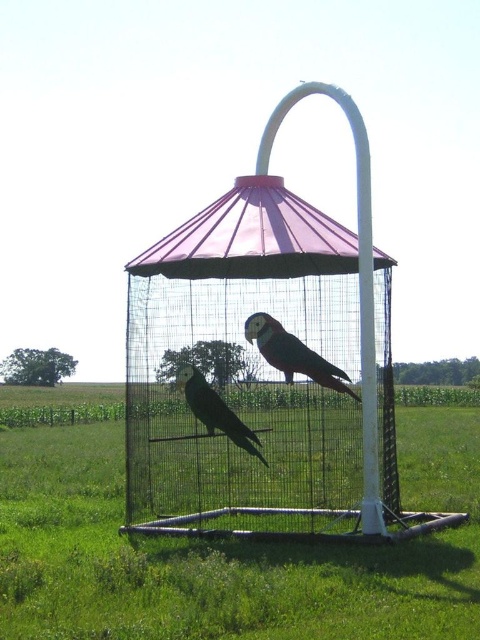
You are standing at the origin point of the coordinate system. You want to walk to the green grass at center. In which direction should you move?

The green grass at center is located at coordinate point 0.864 on the x axis and 0.477 on the y axis. Since you are at the origin, you should move in the positive x and positive y direction to reach the green grass at center.

You are a photographer trying to capture a clear shot of the multicolored feathered parrot at center. However, the green grass at center is blocking your view. Can you determine which direction you should move your camera to the left or right to get an unobstructed view of the parrot?

The green grass at center is positioned on the left side of the multicolored feathered parrot at center. To avoid the obstruction, you should move your camera to the right side so that the parrot becomes visible without the grass blocking it.

You are a small toy that is 10 cm tall. You want to hide inside the pink mesh birdcage at center so that the black matte parrot at center cannot see you. Is the birdcage tall enough for you to stand upright without being visible to the parrot?

The pink mesh birdcage at center is taller than the black matte parrot at center, so yes, the toy can hide inside the birdcage at center without being seen by the parrot since the cage provides enough vertical space.